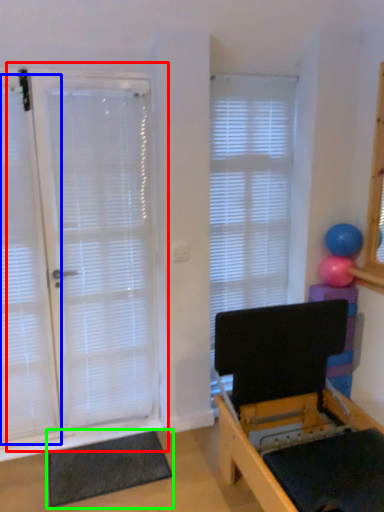
Question: Which object is positioned closest to door (highlighted by a red box)? Select from curtain (highlighted by a blue box) and yoga mat (highlighted by a green box).

Choices:
 (A) curtain
 (B) yoga mat

Answer: (A)